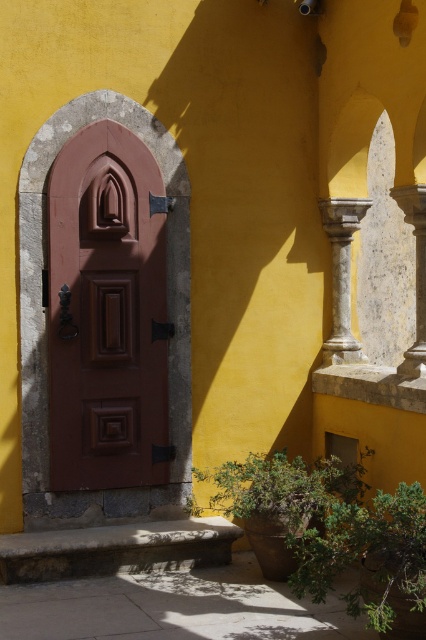
You are an architect designing a new building and want to place a sculpture between the white marble column at center and the smooth stone column at right. Which column should the sculpture be closer to if you want it to be near the smaller column?

The white marble column at center occupies less space than the smooth stone column at right, so the sculpture should be placed closer to the white marble column at center since it is smaller.